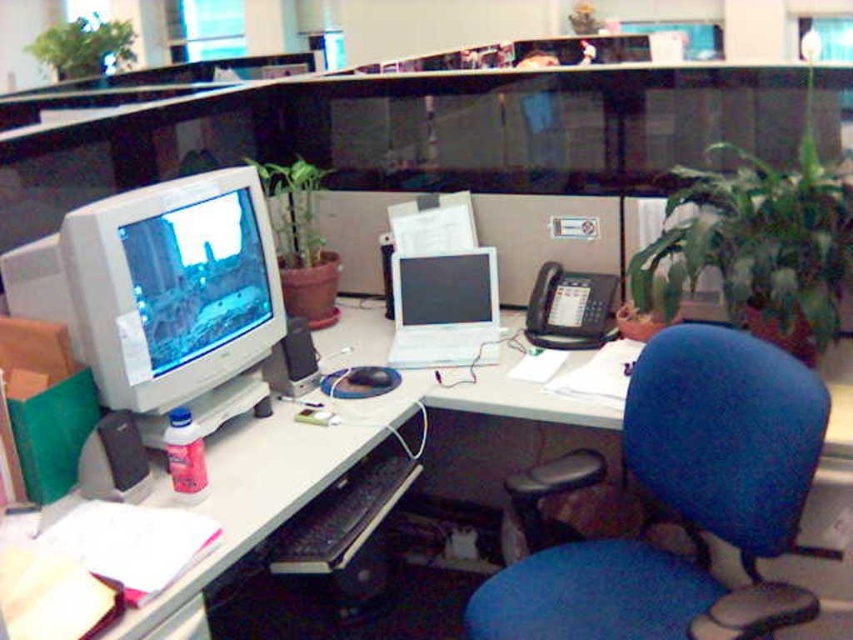
Does matte white monitor at left have a lesser width compared to green leafy plant at right?

Yes.

Between matte white monitor at left and green leafy plant at right, which one has less height?

With less height is matte white monitor at left.

Who is more forward, (241, 365) or (711, 259)?

Point (241, 365)

Where is `matte white monitor at left`? The image size is (853, 640). matte white monitor at left is located at coordinates (173, 288).

Between white plastic desk at center and green leafy plant at right, which one has more height?

green leafy plant at right is taller.

Between white plastic desk at center and green leafy plant at right, which one is positioned higher?

green leafy plant at right is higher up.

Is point (490, 396) farther from viewer compared to point (693, 230)?

That is True.

Identify the location of white plastic desk at center. (341, 458).

Can you confirm if blue fabric swivel chair at center is bigger than white plastic desk at center?

No, blue fabric swivel chair at center is not bigger than white plastic desk at center.

Is blue fabric swivel chair at center to the right of white plastic desk at center from the viewer's perspective?

Yes, blue fabric swivel chair at center is to the right of white plastic desk at center.

Which is behind, point (514, 568) or point (248, 442)?

The point (248, 442) is behind.

Where is `blue fabric swivel chair at center`? The width and height of the screenshot is (853, 640). blue fabric swivel chair at center is located at coordinates (683, 502).